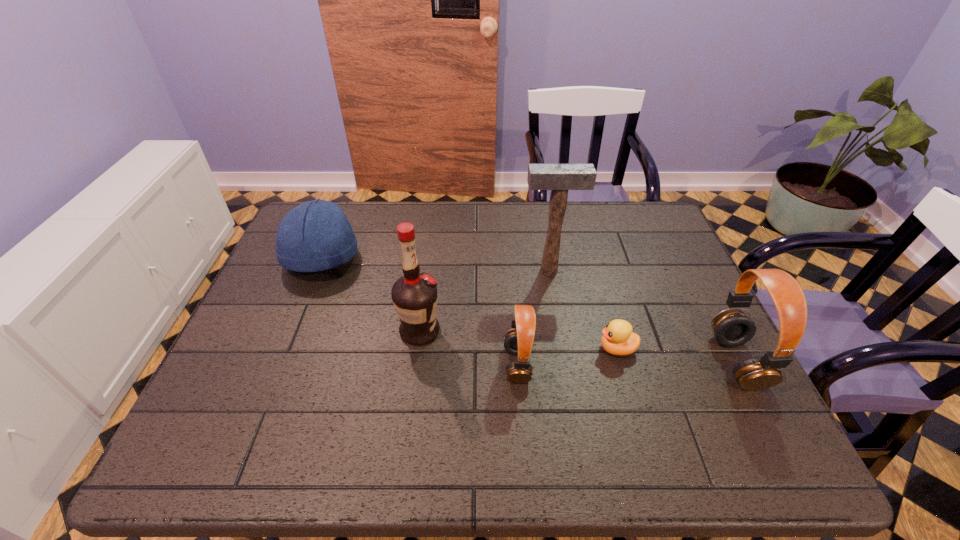
I want to click on free spot between the third object from left to right and the liquor, so click(x=468, y=348).

I want to click on free space between the third object from left to right and the fourth shortest object, so click(x=627, y=363).

Identify the location of vacant space that is in between the leftmost object and the third object from right to left. (435, 264).

The width and height of the screenshot is (960, 540). What are the coordinates of `free space between the taller headset and the mallet` in the screenshot? It's located at click(x=643, y=316).

Find the location of a particular element. The image size is (960, 540). unoccupied area between the fifth object from right to left and the mallet is located at coordinates (484, 301).

The image size is (960, 540). I want to click on free space between the leftmost object and the duckling, so click(469, 303).

Where is `the closest object to the skullcap`? the closest object to the skullcap is located at coordinates (414, 295).

Select which object is the fourth closest to the duckling. Please provide its 2D coordinates. Your answer should be formatted as a tuple, i.e. [(x, y)], where the tuple contains the x and y coordinates of a point satisfying the conditions above.

[(414, 295)]